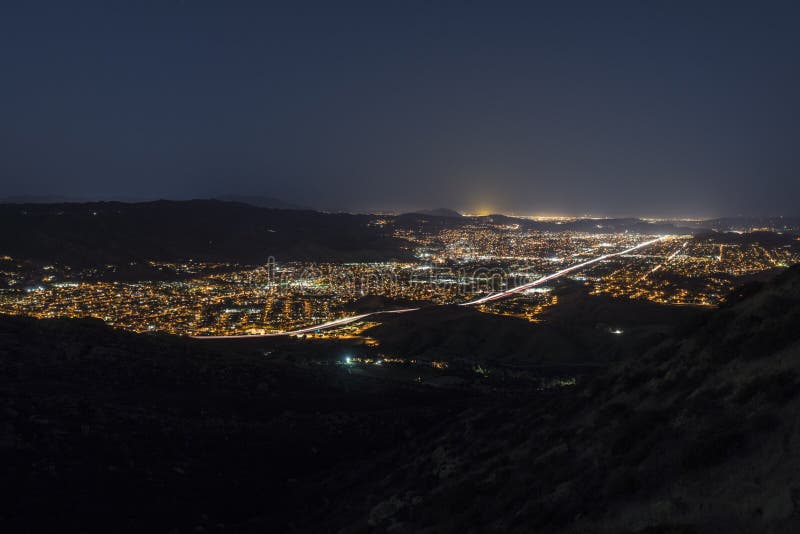
Where is `offices`? The image size is (800, 534). offices is located at coordinates (521, 264).